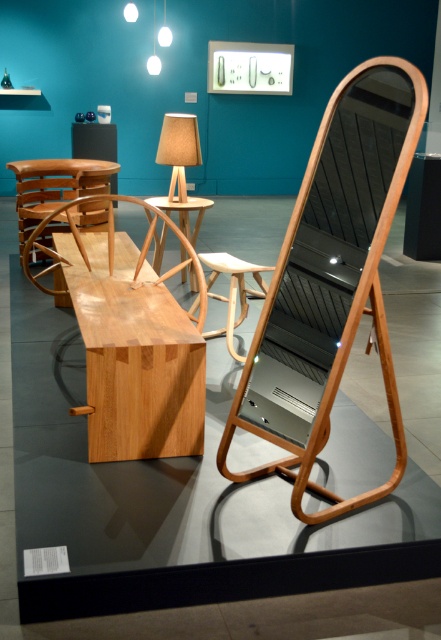
You are arranging a small gathering in the modern furniture display. You need to place a decorative vase on the wooden table at center. To ensure guests can easily access it, where should you position the vase relative to the natural wood bench at center?

You should place the decorative vase on the right side of the wooden table at center, opposite the natural wood bench at center. Since the natural wood bench at center is to the left of the wooden table at center, placing the vase on the right side would make it easily accessible to guests sitting on the bench.

You are setting up a dinner party and need to place a decorative centerpiece on the wooden table at center. The centerpiece is 1.2 meters wide. Can the beige fabric lampshade at center, which is currently on the table, be moved to accommodate the centerpiece without removing it from the table?

The beige fabric lampshade at center has a width less than the wooden table at center, so it can be moved aside to make space for the 1.2 meter wide centerpiece on the table.